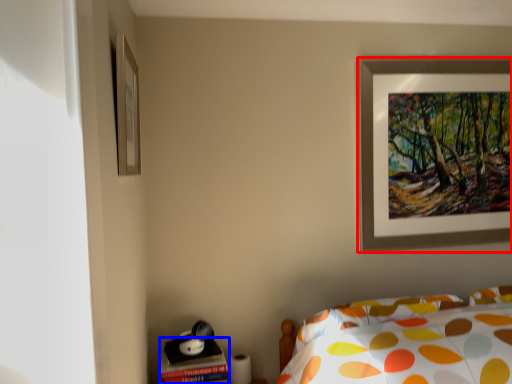
Question: Which point is closer to the camera, picture frame (highlighted by a red box) or table (highlighted by a blue box)?

Choices:
 (A) picture frame
 (B) table

Answer: (B)